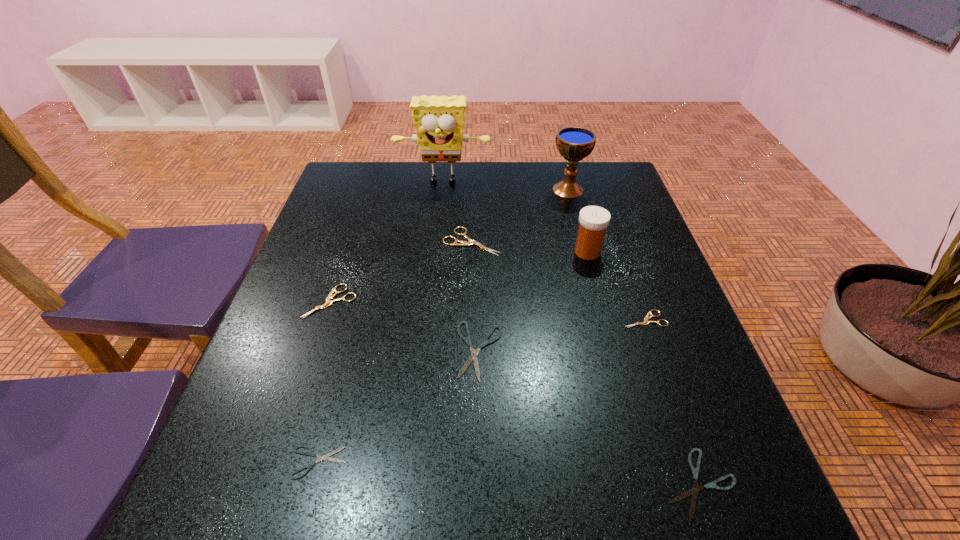
I want to click on object positioned at the far right corner, so click(x=574, y=143).

Find the location of a particular element. This screenshot has height=540, width=960. object present at the near right corner is located at coordinates (694, 491).

In the image, there is a desktop. At what (x,y) coordinates should I click in order to perform the action: click on blank space at the far edge. Please return your answer as a coordinate pair (x, y). This screenshot has height=540, width=960. Looking at the image, I should click on (476, 193).

Locate an element on the screen. The image size is (960, 540). free space at the near edge of the desktop is located at coordinates (540, 498).

Image resolution: width=960 pixels, height=540 pixels. In the image, there is a desktop. Identify the location of free space at the left edge. (344, 233).

At what (x,y) coordinates should I click in order to perform the action: click on free space at the right edge. Please return your answer as a coordinate pair (x, y). This screenshot has width=960, height=540. Looking at the image, I should click on (680, 305).

In the image, there is a desktop. Where is `vacant space at the far left corner`? This screenshot has width=960, height=540. vacant space at the far left corner is located at coordinates (339, 202).

Locate an element on the screen. The image size is (960, 540). free region at the far right corner of the desktop is located at coordinates (581, 168).

The width and height of the screenshot is (960, 540). In order to click on vacant area at the near right corner of the desktop in this screenshot , I will do `click(661, 517)`.

Identify the location of vacant space in between the yellow sponge and the leftmost black shears. (380, 322).